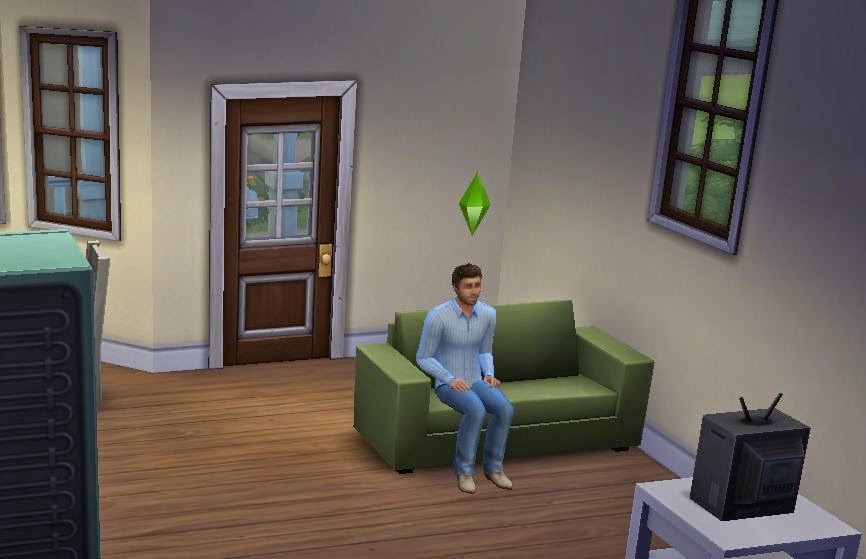
Identify the location of mattress. The image size is (866, 559). (37, 427).